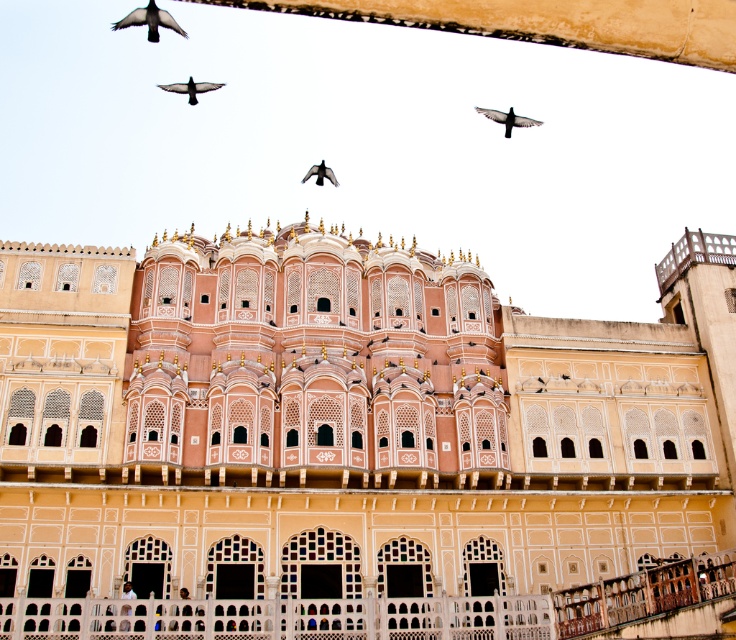
Question: Which of these objects is positioned closest to the black feathered pigeon at upper center?

Choices:
 (A) beige stone palace at center
 (B) dark gray feathered bird at upper center
 (C) black feathered bird at upper left
 (D) black matte bird at upper center

Answer: (D)

Question: Can you confirm if beige stone palace at center is positioned above black feathered bird at upper left?

Choices:
 (A) no
 (B) yes

Answer: (A)

Question: In this image, where is beige stone palace at center located relative to black matte bird at upper center?

Choices:
 (A) right
 (B) left

Answer: (B)

Question: Which point appears farthest from the camera in this image?

Choices:
 (A) (149, 29)
 (B) (325, 173)

Answer: (A)

Question: Among these points, which one is nearest to the camera?

Choices:
 (A) [180, 33]
 (B) [537, 122]
 (C) [7, 573]

Answer: (C)

Question: Where is black matte bird at upper center located in relation to black feathered pigeon at upper center in the image?

Choices:
 (A) left
 (B) right

Answer: (B)